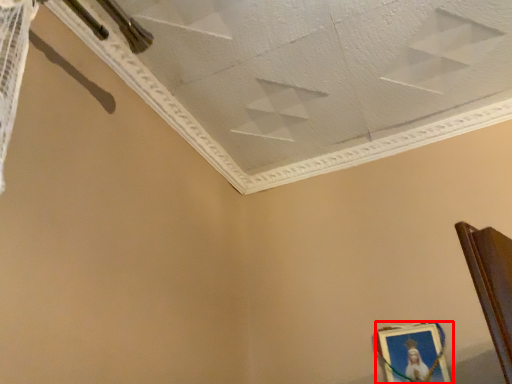
Question: Observing the image, what is the correct spatial positioning of picture frame (annotated by the red box) in reference to wide?

Choices:
 (A) right
 (B) left

Answer: (A)